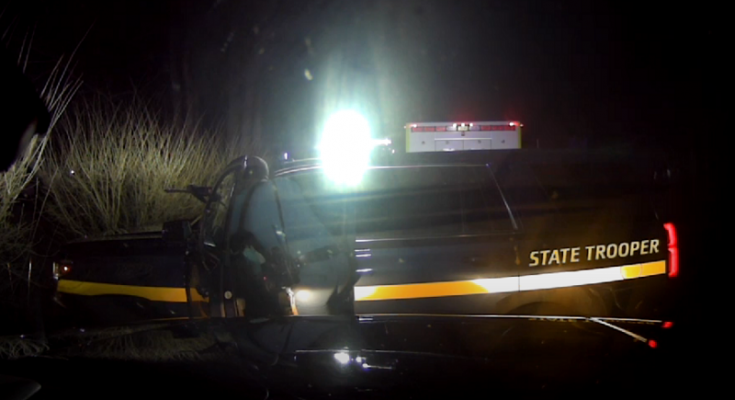
Image resolution: width=735 pixels, height=400 pixels. What are the coordinates of `open door` in the screenshot? It's located at (209, 291).